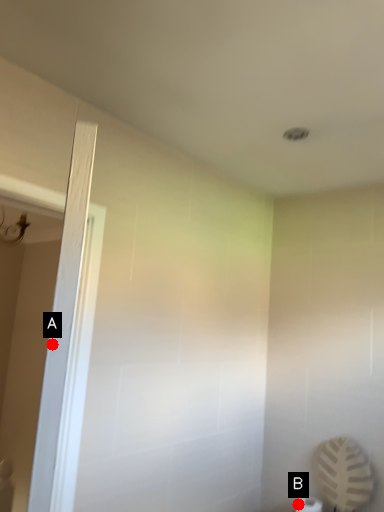
Question: Two points are circled on the image, labeled by A and B beside each circle. Which of the following is the closest to the observer?

Choices:
 (A) A is closer
 (B) B is closer

Answer: (A)